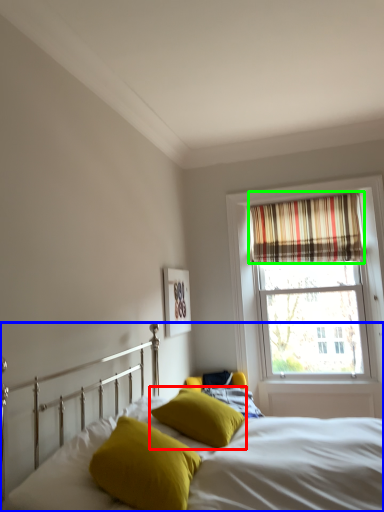
Question: Which object is positioned farthest from pillow (highlighted by a red box)? Select from bed (highlighted by a blue box) and curtain (highlighted by a green box).

Choices:
 (A) bed
 (B) curtain

Answer: (B)